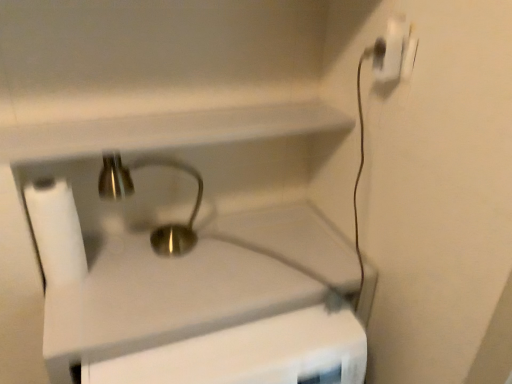
Image resolution: width=512 pixels, height=384 pixels. I want to click on space that is in front of polished brass faucet at center, so click(x=157, y=296).